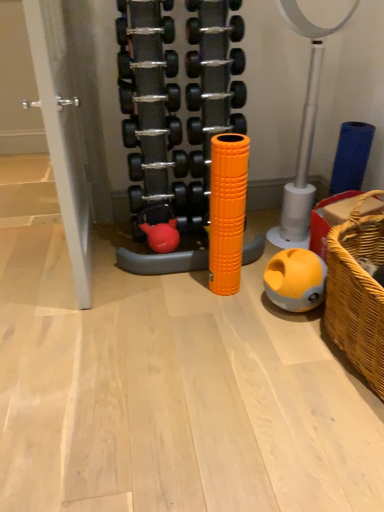
Identify the location of vacant region to the left of yellow matte ball at lower right, positioned as the third toy in top-to-bottom order. This screenshot has width=384, height=512. (250, 308).